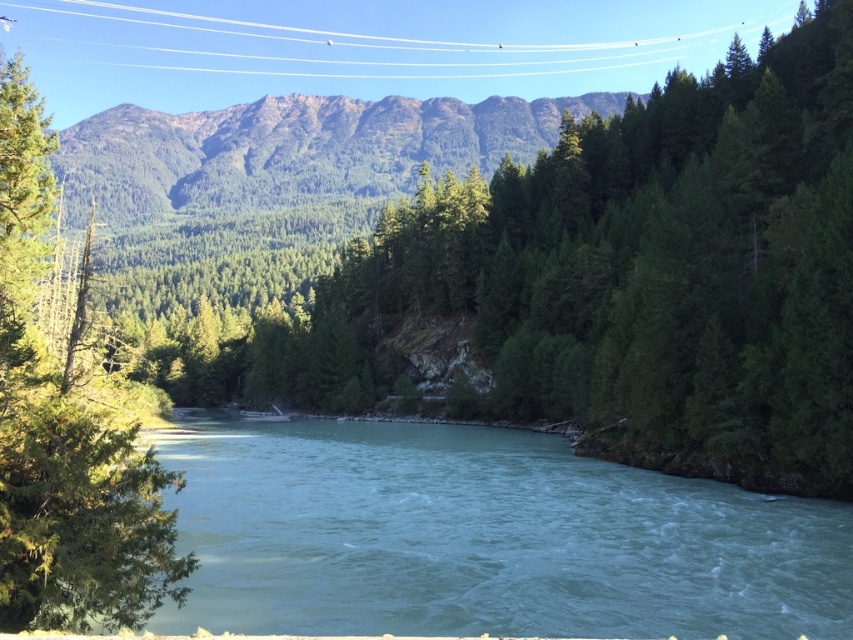
Can you confirm if turquoise water at center is thinner than green matte tree at left?

In fact, turquoise water at center might be wider than green matte tree at left.

Based on the photo, does turquoise water at center have a greater height compared to green matte tree at left?

In fact, turquoise water at center may be shorter than green matte tree at left.

Is point (585, 628) farther from camera compared to point (7, 113)?

No.

You are a GUI agent. You are given a task and a screenshot of the screen. Output one action in this format:
    pyautogui.click(x=<x>, y=<y>)
    Task: Click on the turquoise water at center
    The image size is (853, 640).
    Given the screenshot: What is the action you would take?
    pyautogui.click(x=485, y=538)

Who is lower down, turquoise water at center or green textured mountain at upper center?

turquoise water at center is below.

Is point (711, 545) more distant than point (527, 100)?

No, (711, 545) is closer to viewer.

Find the location of a particular element. turquoise water at center is located at coordinates (485, 538).

Is green matte tree at left to the left of green textured mountain at upper center from the viewer's perspective?

Incorrect, green matte tree at left is not on the left side of green textured mountain at upper center.

Image resolution: width=853 pixels, height=640 pixels. Describe the element at coordinates (64, 433) in the screenshot. I see `green matte tree at left` at that location.

Is point (20, 284) positioned in front of point (78, 221)?

That is True.

Find the location of `green matte tree at left`. green matte tree at left is located at coordinates (64, 433).